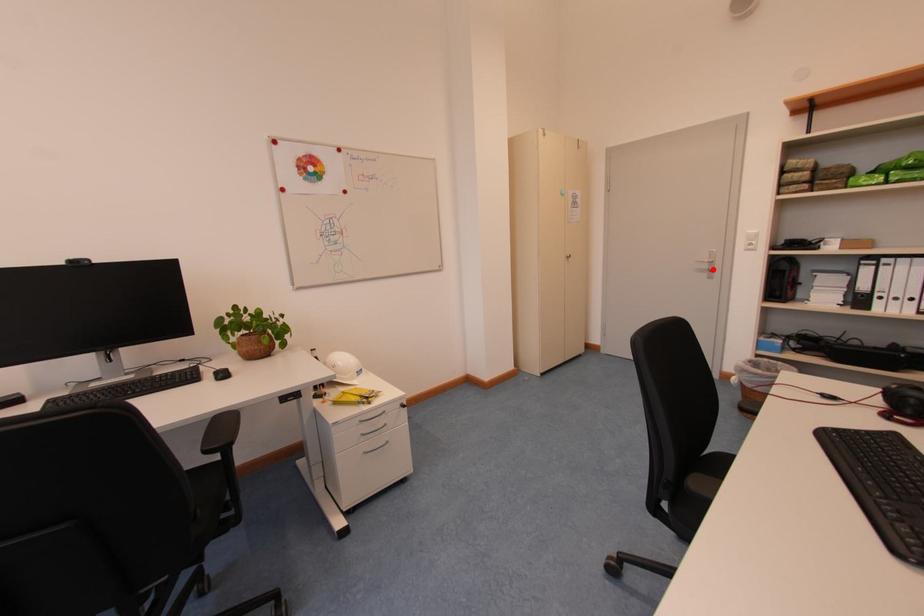
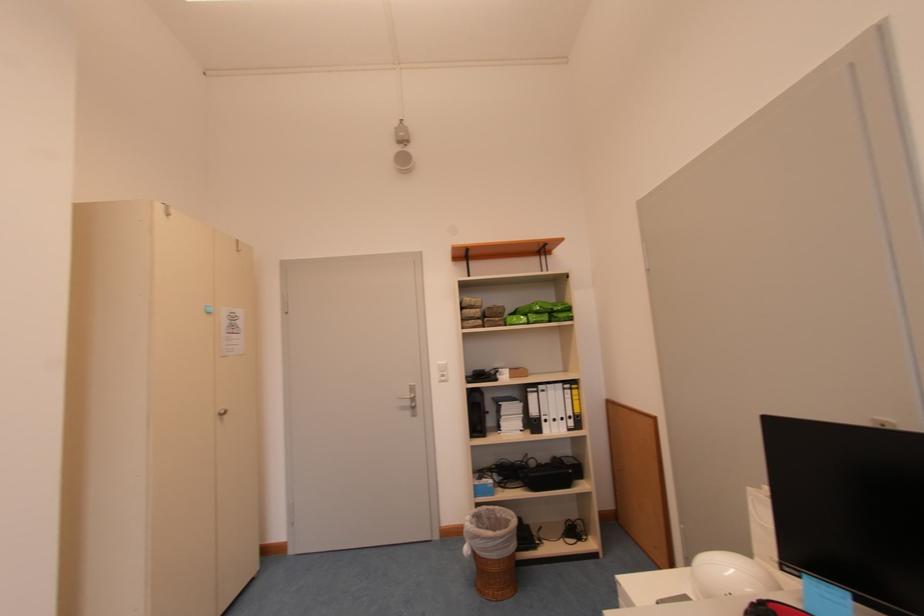
Question: I am providing you with two images of the same scene from different viewpoints. Image1 has a red point marked. In image2, the corresponding 3D location appears at what relative position? Reply with the corresponding letter.

Choices:
 (A) Closer
 (B) Farther

Answer: (B)